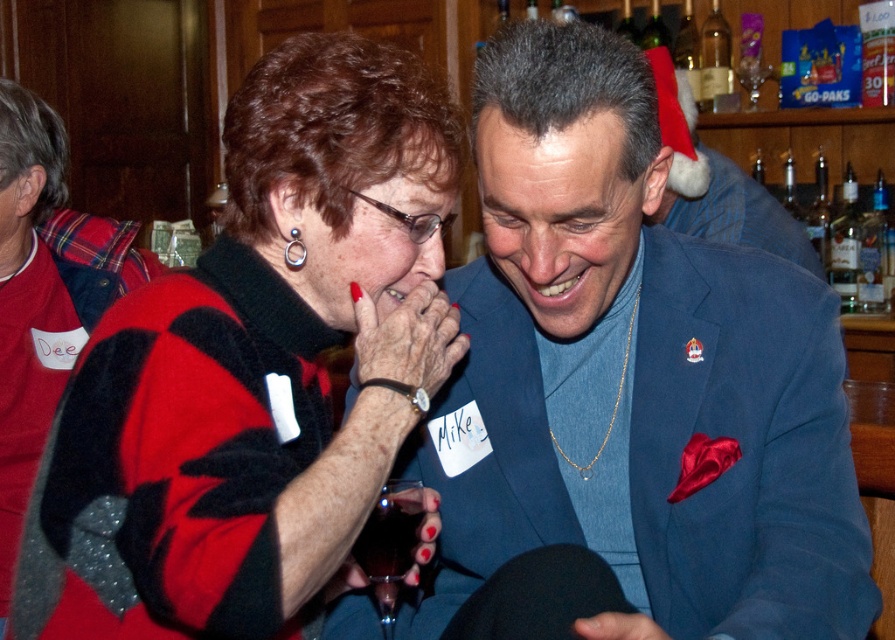
Question: Can you confirm if red/black sweater at center is positioned to the left of transparent glass at lower center?

Choices:
 (A) no
 (B) yes

Answer: (B)

Question: Which of the following is the closest to the observer?

Choices:
 (A) red/black sweater at center
 (B) blue satin suit at center

Answer: (A)

Question: Does red/black sweater at center have a smaller size compared to transparent glass at lower center?

Choices:
 (A) no
 (B) yes

Answer: (A)

Question: Among these objects, which one is nearest to the camera?

Choices:
 (A) red/black sweater at center
 (B) blue satin suit at center
 (C) transparent glass at lower center

Answer: (A)

Question: Which point is closer to the camera?

Choices:
 (A) blue satin suit at center
 (B) red/black sweater at center
 (C) transparent glass at lower center

Answer: (B)

Question: Where is blue satin suit at center located in relation to transparent glass at lower center in the image?

Choices:
 (A) above
 (B) below

Answer: (A)